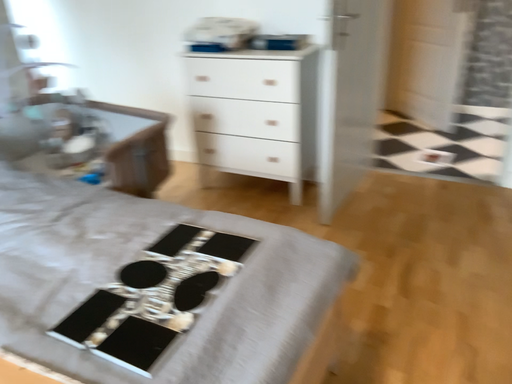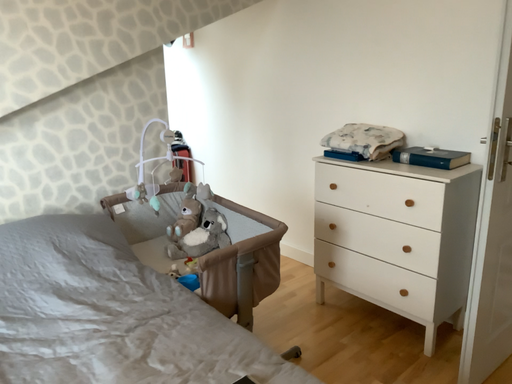
Question: How did the camera likely rotate when shooting the video?

Choices:
 (A) rotated left
 (B) rotated right

Answer: (A)